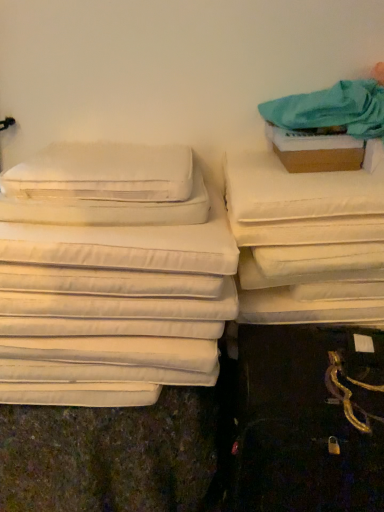
Question: Considering the relative sizes of white fabric mattress at right and white soft pillow at upper left, the 2th pillow positioned from the bottom, in the image provided, is white fabric mattress at right shorter than white soft pillow at upper left, the 2th pillow positioned from the bottom,?

Choices:
 (A) no
 (B) yes

Answer: (B)

Question: Is the position of white fabric mattress at right less distant than that of white soft pillow at upper left, the 1th pillow viewed from the top?

Choices:
 (A) no
 (B) yes

Answer: (A)

Question: Is the position of white fabric mattress at right more distant than that of white soft pillow at upper left, the 1th pillow viewed from the top?

Choices:
 (A) yes
 (B) no

Answer: (A)

Question: Is white fabric mattress at right outside of white soft pillow at upper left, the 1th pillow viewed from the top?

Choices:
 (A) yes
 (B) no

Answer: (A)

Question: Is white fabric mattress at right oriented towards white soft pillow at upper left, the 2th pillow positioned from the bottom?

Choices:
 (A) no
 (B) yes

Answer: (A)

Question: From a real-world perspective, is white fabric mattress at right below white soft pillow at upper left, the 2th pillow positioned from the bottom?

Choices:
 (A) yes
 (B) no

Answer: (A)

Question: Considering the relative sizes of white soft pillow at left, the 1th pillow positioned from the bottom, and brown cardboard box at upper right in the image provided, is white soft pillow at left, the 1th pillow positioned from the bottom, bigger than brown cardboard box at upper right?

Choices:
 (A) yes
 (B) no

Answer: (A)

Question: Is white soft pillow at left, the second pillow from the top, oriented away from brown cardboard box at upper right?

Choices:
 (A) no
 (B) yes

Answer: (A)

Question: Can you confirm if white soft pillow at left, the second pillow from the top, is shorter than brown cardboard box at upper right?

Choices:
 (A) no
 (B) yes

Answer: (A)

Question: Is white soft pillow at left, the 1th pillow positioned from the bottom, at the left side of brown cardboard box at upper right?

Choices:
 (A) no
 (B) yes

Answer: (B)

Question: From a real-world perspective, is white soft pillow at left, the second pillow from the top, located higher than brown cardboard box at upper right?

Choices:
 (A) no
 (B) yes

Answer: (A)

Question: Are white soft pillow at left, the second pillow from the top, and brown cardboard box at upper right far apart?

Choices:
 (A) no
 (B) yes

Answer: (A)

Question: Can you confirm if white fabric mattress at right is wider than white soft pillow at left, the second pillow from the top?

Choices:
 (A) no
 (B) yes

Answer: (B)